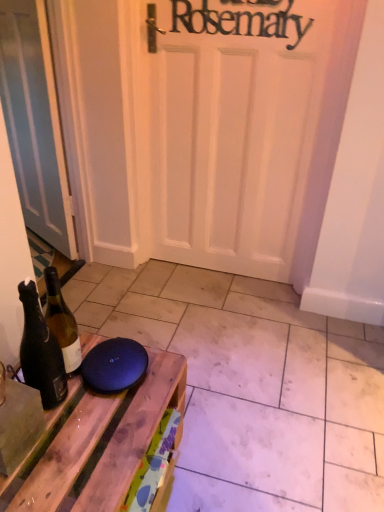
Question: Should I look upward or downward to see matte wood tile at lower center?

Choices:
 (A) up
 (B) down

Answer: (B)

Question: Should I look upward or downward to see wooden table at lower left?

Choices:
 (A) down
 (B) up

Answer: (A)

Question: Does wooden table at lower left have a lesser width compared to dark brown glass bottle at left?

Choices:
 (A) no
 (B) yes

Answer: (A)

Question: Does wooden table at lower left have a larger size compared to dark brown glass bottle at left?

Choices:
 (A) no
 (B) yes

Answer: (B)

Question: Can you confirm if wooden table at lower left is positioned to the left of dark brown glass bottle at left?

Choices:
 (A) no
 (B) yes

Answer: (A)

Question: Can dark brown glass bottle at left be found inside wooden table at lower left?

Choices:
 (A) no
 (B) yes

Answer: (A)

Question: Is wooden table at lower left aimed at dark brown glass bottle at left?

Choices:
 (A) yes
 (B) no

Answer: (B)

Question: Can you confirm if wooden table at lower left is positioned to the right of dark brown glass bottle at left?

Choices:
 (A) no
 (B) yes

Answer: (B)

Question: Does matte white door at left have a greater height compared to matte wood tile at lower center?

Choices:
 (A) yes
 (B) no

Answer: (A)

Question: Is matte white door at left in front of matte wood tile at lower center?

Choices:
 (A) no
 (B) yes

Answer: (A)

Question: Is matte white door at left at the right side of matte wood tile at lower center?

Choices:
 (A) yes
 (B) no

Answer: (B)

Question: Could you tell me if matte white door at left is turned towards matte wood tile at lower center?

Choices:
 (A) yes
 (B) no

Answer: (B)

Question: Does matte white door at left have a larger size compared to matte wood tile at lower center?

Choices:
 (A) yes
 (B) no

Answer: (B)

Question: Considering the relative sizes of matte white door at left and matte wood tile at lower center in the image provided, is matte white door at left wider than matte wood tile at lower center?

Choices:
 (A) no
 (B) yes

Answer: (A)

Question: Can you confirm if matte wood tile at lower center is smaller than matte white door at left?

Choices:
 (A) no
 (B) yes

Answer: (A)